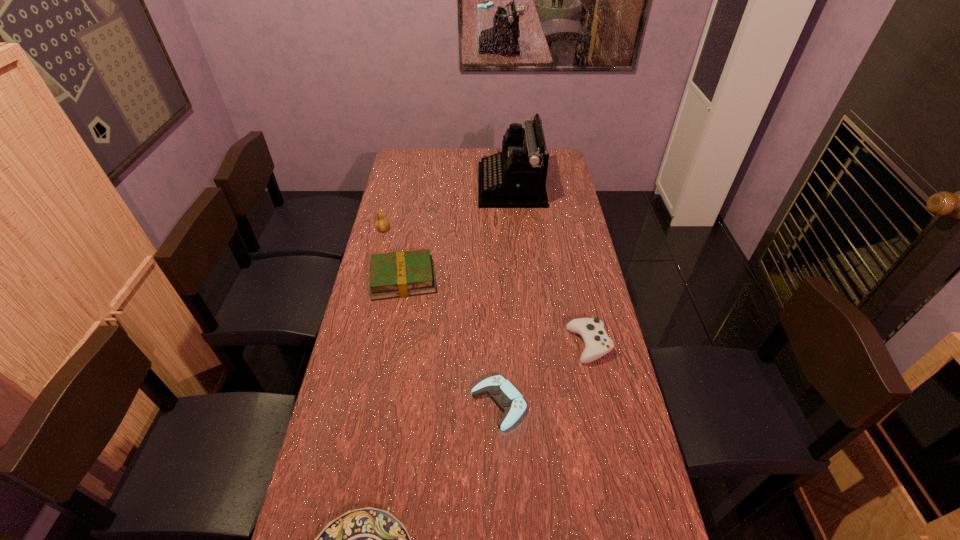
I want to click on blank region between the typewriter and the fourth nearest object, so click(x=457, y=232).

The image size is (960, 540). Identify the location of object that is the fourth closest to the second farthest object. (597, 343).

At what (x,y) coordinates should I click in order to perform the action: click on object that stands as the fourth closest to the right control. Please return your answer as a coordinate pair (x, y). The width and height of the screenshot is (960, 540). Looking at the image, I should click on (516, 177).

Locate an element on the screen. The image size is (960, 540). vacant space that satisfies the following two spatial constraints: 1. on the typing side of the typewriter; 2. on the front side of the nearer control is located at coordinates (531, 404).

You are a GUI agent. You are given a task and a screenshot of the screen. Output one action in this format:
    pyautogui.click(x=<x>, y=<y>)
    Task: Click on the free space that satisfies the following two spatial constraints: 1. on the back side of the farther control; 2. on the typing side of the tallest object
    The width and height of the screenshot is (960, 540).
    Given the screenshot: What is the action you would take?
    pyautogui.click(x=555, y=186)

I want to click on free space that satisfies the following two spatial constraints: 1. on the front side of the shorter control; 2. on the right side of the second farthest object, so click(x=341, y=404).

Image resolution: width=960 pixels, height=540 pixels. I want to click on vacant space that satisfies the following two spatial constraints: 1. on the typing side of the tallest object; 2. on the front side of the left control, so click(531, 404).

Where is `free location that satisfies the following two spatial constraints: 1. on the front side of the farther control; 2. on the left side of the third farthest object`? This screenshot has width=960, height=540. free location that satisfies the following two spatial constraints: 1. on the front side of the farther control; 2. on the left side of the third farthest object is located at coordinates (392, 345).